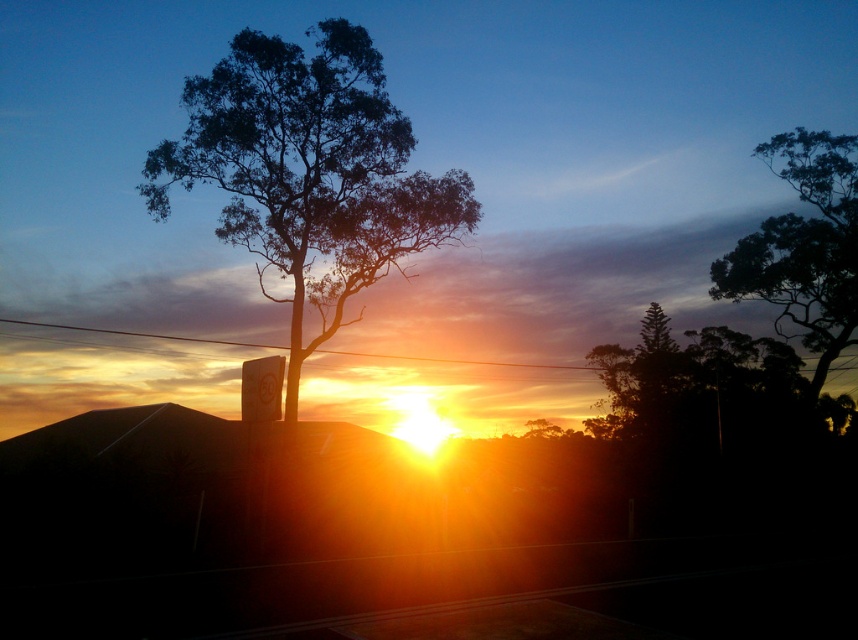
Is dark green leafy tree at center taller than dark green leafy tree at upper right?

Yes.

Which is behind, point (264, 289) or point (823, 253)?

The point (823, 253) is behind.

Find the location of a particular element. dark green leafy tree at center is located at coordinates (309, 170).